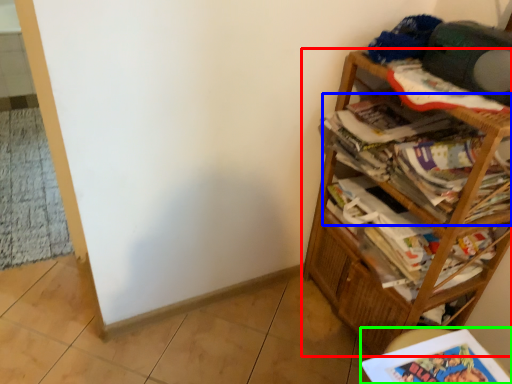
Question: Considering the real-world distances, which object is closest to bookcase (highlighted by a red box)? magazine (highlighted by a blue box) or book (highlighted by a green box).

Choices:
 (A) magazine
 (B) book

Answer: (A)